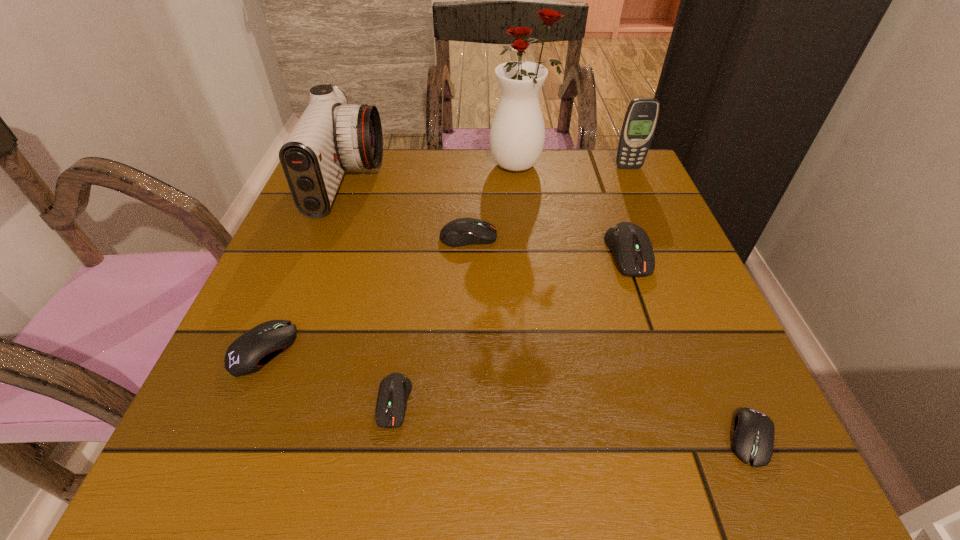
This screenshot has height=540, width=960. I want to click on the third object from left to right, so click(x=394, y=390).

Identify the location of the leftmost dark computer equipment. The height and width of the screenshot is (540, 960). coord(394,390).

At what (x,y) coordinates should I click in order to perform the action: click on the nearer black computer equipment. Please return your answer as a coordinate pair (x, y). The height and width of the screenshot is (540, 960). Looking at the image, I should click on (753, 439).

I want to click on the smaller black computer equipment, so click(753, 439).

I want to click on vacant space located on the front of the tallest object, so click(534, 269).

Identify the location of vacant space located on the surface of the camcorder. The width and height of the screenshot is (960, 540). (540, 183).

I want to click on vacant space situated on the screen of the gray cellular telephone, so click(640, 194).

The height and width of the screenshot is (540, 960). I want to click on free space located 0.180m on the button of the biggest dark computer equipment, so click(x=666, y=359).

Where is `free spot located 0.310m on the button of the second dark computer equipment from right to left`? This screenshot has height=540, width=960. free spot located 0.310m on the button of the second dark computer equipment from right to left is located at coordinates (645, 237).

Image resolution: width=960 pixels, height=540 pixels. I want to click on vacant area located 0.320m on the back of the leftmost computer equipment, so click(x=322, y=212).